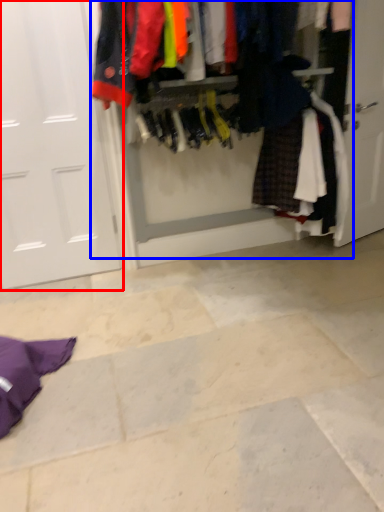
Question: Which object appears farthest to the camera in this image, door (highlighted by a red box) or closet (highlighted by a blue box)?

Choices:
 (A) door
 (B) closet

Answer: (A)